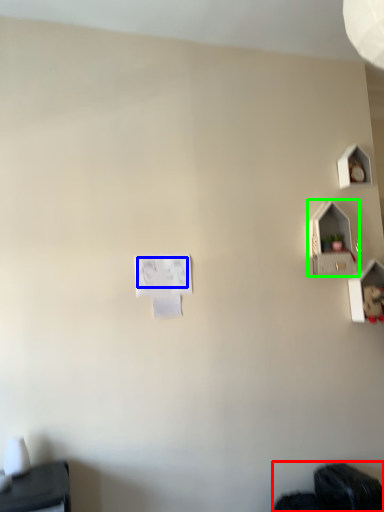
Question: Estimate the real-world distances between objects in this image. Which object is farther from wide (highlighted by a red box), writing (highlighted by a blue box) or twin (highlighted by a green box)?

Choices:
 (A) writing
 (B) twin

Answer: (A)